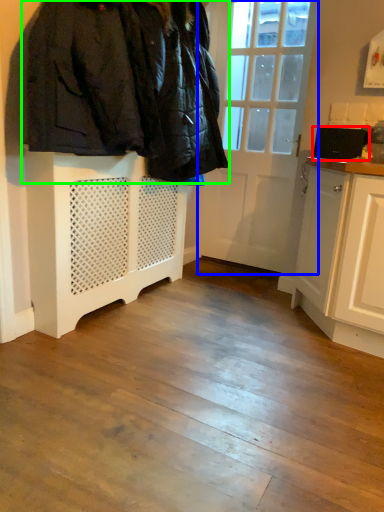
Question: Based on their relative distances, which object is nearer to appliance (highlighted by a red box)? Choose from door (highlighted by a blue box) and furniture (highlighted by a green box).

Choices:
 (A) door
 (B) furniture

Answer: (A)